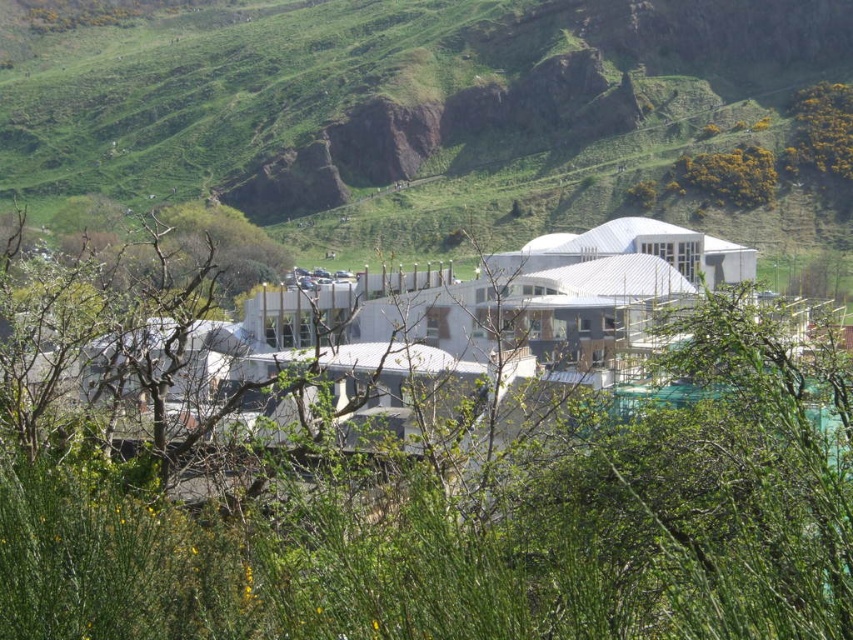
You are a landscape architect planning to install a walkway between the green leafy shrubs at center and the green grassy hillside at center. The walkway requires a minimum of 75 meters to accommodate all planned features. Based on the scene, will the available space between these two areas be sufficient?

The distance between the green leafy shrubs at center and the green grassy hillside at center is 82.08 meters, which exceeds the required 75 meters. Therefore, the available space is sufficient to accommodate the walkway with all planned features.

You are a landscape architect planning to install a small garden path between the green leafy shrubs at center and the green grassy hillside at center. Based on their widths, which one would require more space to accommodate the path?

The green grassy hillside at center has a greater width than the green leafy shrubs at center, so the path would need to be wider to accommodate the green grassy hillside at center.